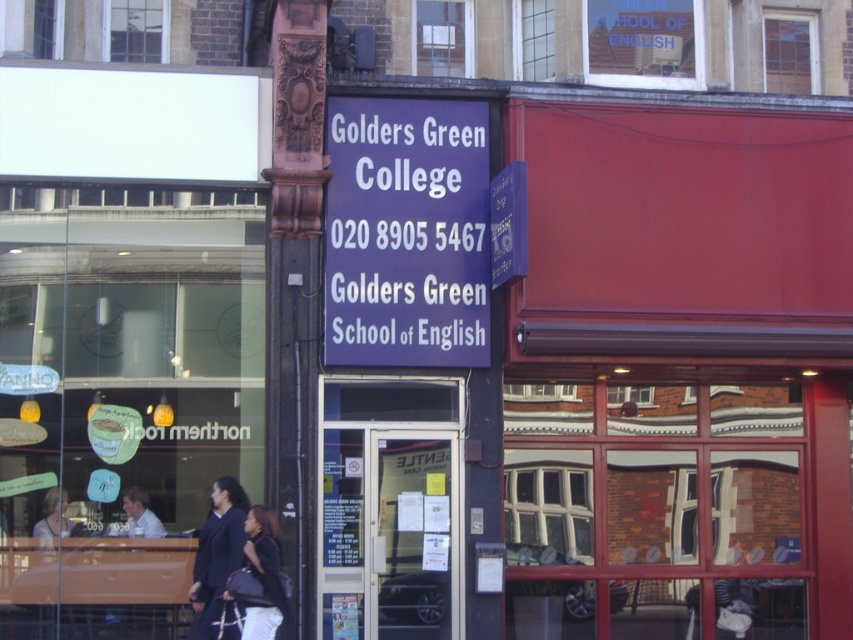
Which is in front, point (401, 104) or point (264, 620)?

Point (264, 620)

Does purple matte sign at center have a smaller size compared to matte black jacket at center?

Incorrect, purple matte sign at center is not smaller in size than matte black jacket at center.

Between point (439, 298) and point (263, 572), which one is positioned in front?

Point (263, 572) is more forward.

At what (x,y) coordinates should I click in order to perform the action: click on purple matte sign at center. Please return your answer as a coordinate pair (x, y). This screenshot has height=640, width=853. Looking at the image, I should click on (405, 234).

Can you confirm if matte black jacket at center is positioned to the left of matte black jacket at lower left?

Incorrect, matte black jacket at center is not on the left side of matte black jacket at lower left.

Is matte black jacket at center in front of matte black jacket at lower left?

Yes, it is in front of matte black jacket at lower left.

Which is behind, point (271, 595) or point (68, 525)?

Positioned behind is point (68, 525).

Identify the location of matte black jacket at center. This screenshot has width=853, height=640. (262, 576).

Does purple matte sign at center appear on the right side of dark blue fabric coat at center?

Correct, you'll find purple matte sign at center to the right of dark blue fabric coat at center.

Can you confirm if purple matte sign at center is smaller than dark blue fabric coat at center?

No, purple matte sign at center is not smaller than dark blue fabric coat at center.

What do you see at coordinates (405, 234) in the screenshot? I see `purple matte sign at center` at bounding box center [405, 234].

Locate an element on the screen. Image resolution: width=853 pixels, height=640 pixels. purple matte sign at center is located at coordinates (405, 234).